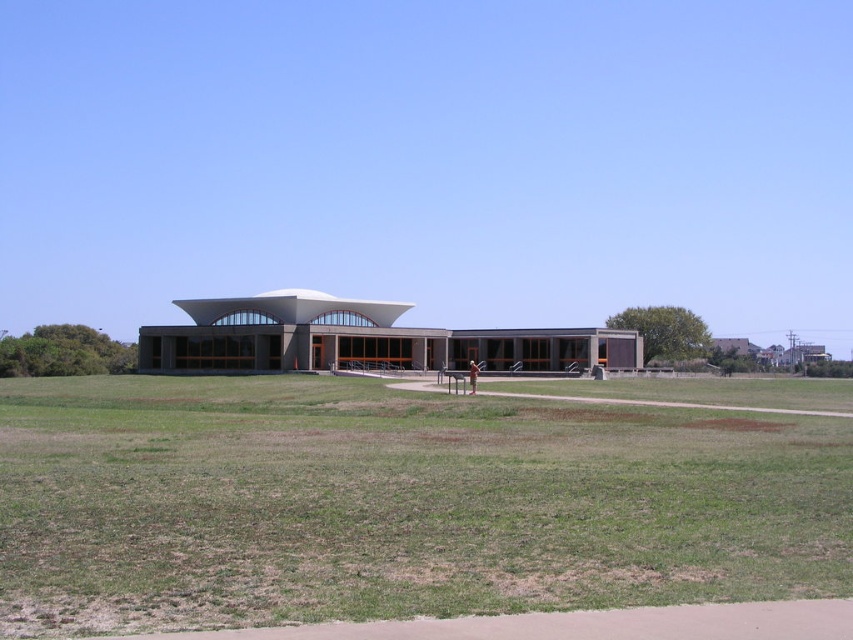
Does green grass at center have a lesser width compared to brown textured shorts at center?

In fact, green grass at center might be wider than brown textured shorts at center.

Does point (297, 602) lie behind point (474, 388)?

No, it is in front of (474, 388).

Who is more forward, (74, 444) or (474, 381)?

Point (74, 444) is in front.

Locate an element on the screen. The image size is (853, 640). green grass at center is located at coordinates (395, 502).